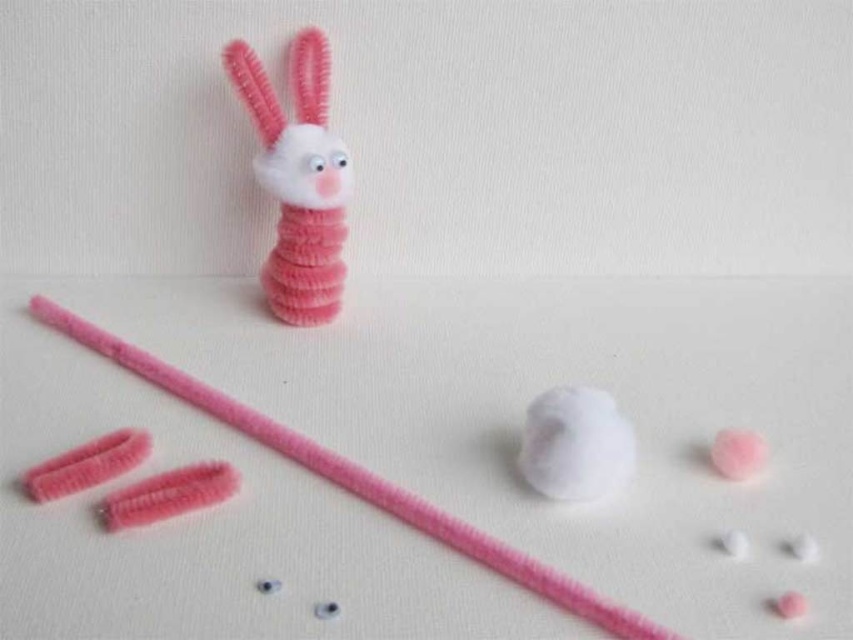
You are trying to decide which material to use for a craft project. You have a matte pink pipe cleaner at center and a white fluffy ball at center. Which one is wider?

The matte pink pipe cleaner at center might be wider than the white fluffy ball at center according to the description.

You are holding a magnifying glass and observing the craft project. Which object, the fuzzy pink pipe cleaner at center or the white fluffy ball at center, appears larger in your view?

The fuzzy pink pipe cleaner at center appears larger because it is closer to the viewer than the white fluffy ball at center.

You are organizing a craft kit and need to place the matte pink pipe cleaner at center and the white fluffy ball at center into a vertical storage container. Which object should you place first to ensure both fit vertically?

The white fluffy ball at center is shorter than the matte pink pipe cleaner at center, so you should place the white fluffy ball at center first to make space for the taller pipe cleaner.